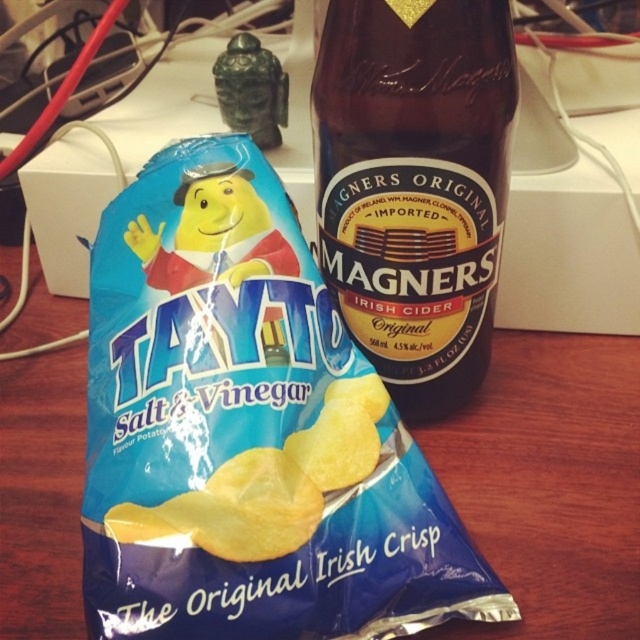
You are organizing items on a desk. You have a blue matte plastic bag of chips at center and a brown glass bottle at center. Which item is positioned lower on the desk?

The blue matte plastic bag of chips at center is positioned lower than the brown glass bottle at center.

You are organizing items on a desk and need to place a small notebook between the brown glass bottle at center and the blue matte chips at center. According to the items in the image, where should you position the notebook to ensure it sits between them?

The brown glass bottle at center is located above the blue matte chips at center, so you should place the notebook between them by positioning it below the bottle and above the chips.

Based on the photo, you are standing in front of a desk with two items. There is a point at (353, 49) and another at (323, 488). Which point is closer to you?

Point at (353, 49) is closer to you because it is further to the camera than point at (323, 488).